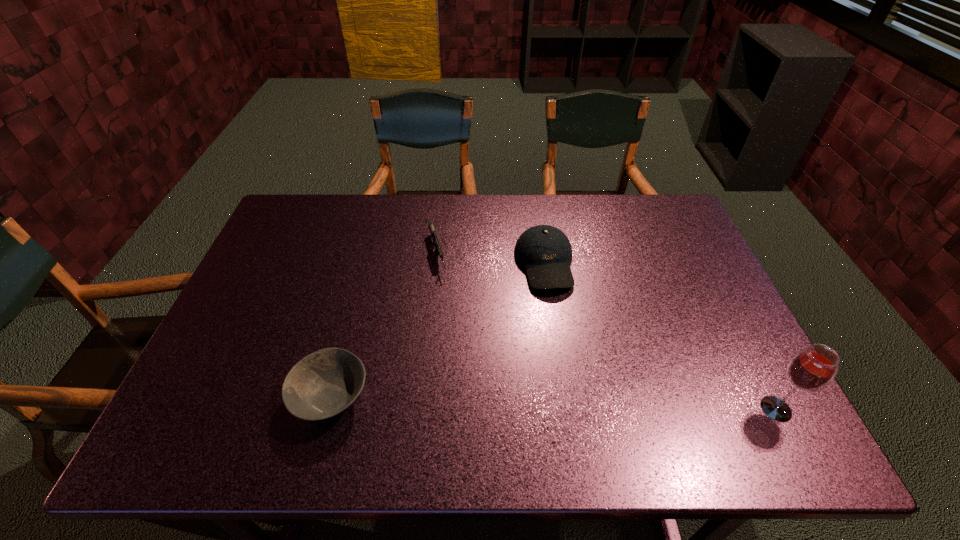
Image resolution: width=960 pixels, height=540 pixels. Identify the location of bowl. (325, 383).

At what (x,y) coordinates should I click in order to perform the action: click on wineglass. Please return your answer as a coordinate pair (x, y). Image resolution: width=960 pixels, height=540 pixels. Looking at the image, I should click on pos(812,369).

The height and width of the screenshot is (540, 960). I want to click on the tallest object, so click(812, 369).

This screenshot has height=540, width=960. Find the location of `baseball cap`. baseball cap is located at coordinates (545, 252).

This screenshot has width=960, height=540. I want to click on the third shortest object, so click(x=545, y=252).

The image size is (960, 540). In order to click on the second object from left to right in this screenshot , I will do `click(438, 248)`.

The height and width of the screenshot is (540, 960). Identify the location of vacant space located 0.230m on the right of the leftmost object. (471, 397).

Find the location of a particular element. The width and height of the screenshot is (960, 540). free space located on the back of the wineglass is located at coordinates pos(748,354).

The image size is (960, 540). I want to click on blank area located on the front-facing side of the third shortest object, so click(571, 370).

Identify the location of free space located on the front-facing side of the third shortest object. (560, 325).